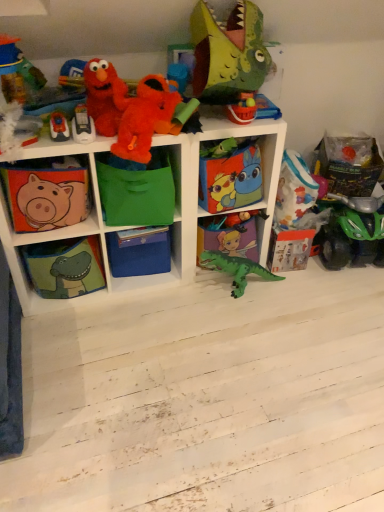
You are a GUI agent. You are given a task and a screenshot of the screen. Output one action in this format:
    pyautogui.click(x=<x>, y=<y>)
    Task: Click on the vacant area situated to the left side of matte plastic bucket at upper center, positioned as the 4th toy in bottom-to-top order
    
    Given the screenshot: What is the action you would take?
    pyautogui.click(x=209, y=117)